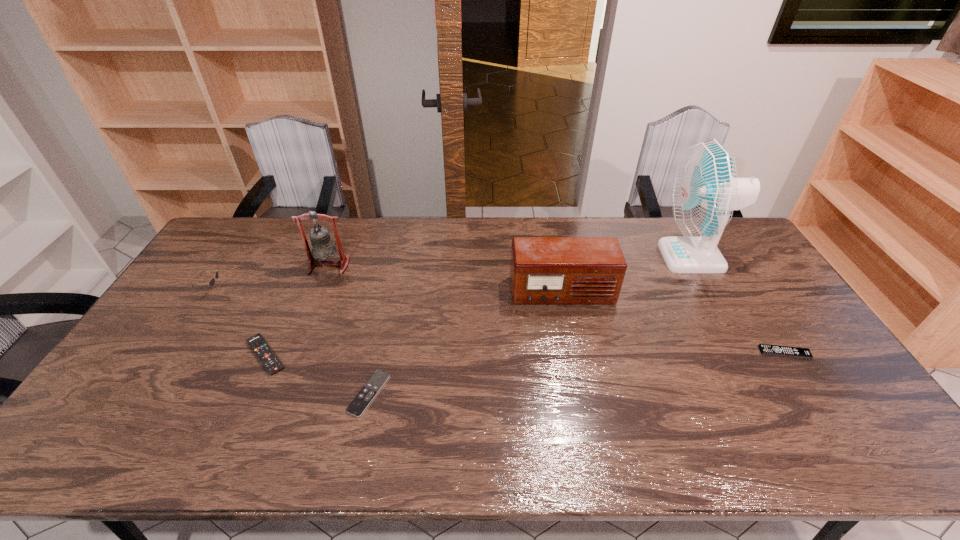
Identify the location of bell present at the far edge. This screenshot has height=540, width=960. (323, 247).

Image resolution: width=960 pixels, height=540 pixels. Identify the location of object located in the left edge section of the desktop. pos(212,281).

Identify the location of fan positioned at the right edge. The image size is (960, 540). (705, 191).

Identify the location of remote control that is at the right edge. (765, 349).

I want to click on object present at the far right corner, so click(x=705, y=191).

The image size is (960, 540). In the image, there is a desktop. What are the coordinates of `vacant space at the far edge` in the screenshot? It's located at (352, 249).

At what (x,y) coordinates should I click in order to perform the action: click on vacant area at the near edge of the desktop. Please return your answer as a coordinate pair (x, y). The height and width of the screenshot is (540, 960). Looking at the image, I should click on (320, 444).

The image size is (960, 540). What are the coordinates of `vacant space at the left edge` in the screenshot? It's located at (226, 273).

This screenshot has width=960, height=540. In order to click on free point at the right edge in this screenshot , I will do `click(777, 294)`.

In order to click on vacant space at the far left corner of the desktop in this screenshot , I will do `click(254, 220)`.